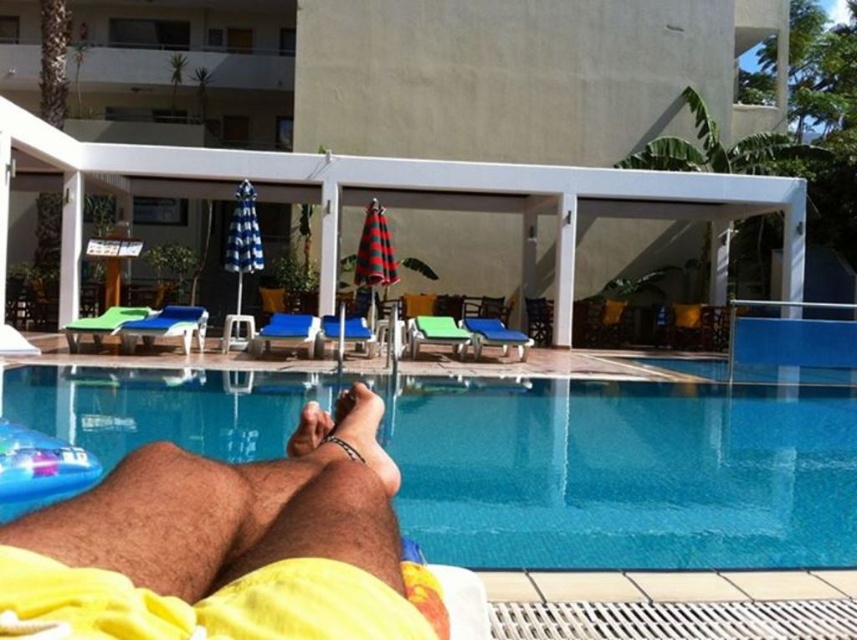
Between white plastic patio at center and blue glossy water at center, which one is positioned lower?

blue glossy water at center

Is white plastic patio at center thinner than blue glossy water at center?

No.

Is point (556, 1) positioned in front of point (193, 442)?

No, it is behind (193, 442).

The width and height of the screenshot is (857, 640). What are the coordinates of `white plastic patio at center` in the screenshot? It's located at [x=451, y=140].

This screenshot has width=857, height=640. Identify the location of blue glossy water at center. (622, 474).

Looking at this image, does blue glossy water at center appear under smooth skin foot at lower center?

Indeed, blue glossy water at center is positioned under smooth skin foot at lower center.

Which is behind, point (621, 474) or point (340, 404)?

Point (621, 474)

You are a GUI agent. You are given a task and a screenshot of the screen. Output one action in this format:
    pyautogui.click(x=<x>, y=<y>)
    Task: Click on the blue glossy water at center
    
    Given the screenshot: What is the action you would take?
    pyautogui.click(x=622, y=474)

Which is in front, point (16, 568) or point (322, 422)?

Positioned in front is point (16, 568).

Does yellow fabric at lower center appear over smooth skin foot at lower center?

Incorrect, yellow fabric at lower center is not positioned above smooth skin foot at lower center.

Who is more forward, (16,586) or (343,440)?

Point (16,586) is more forward.

Locate an element on the screen. yellow fabric at lower center is located at coordinates (223, 545).